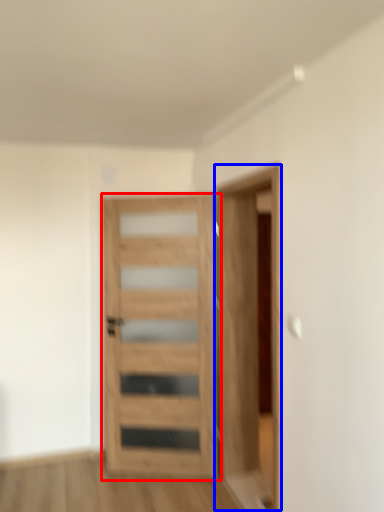
Question: Which of the following is the farthest to the observer, door (highlighted by a red box) or garage door (highlighted by a blue box)?

Choices:
 (A) door
 (B) garage door

Answer: (A)